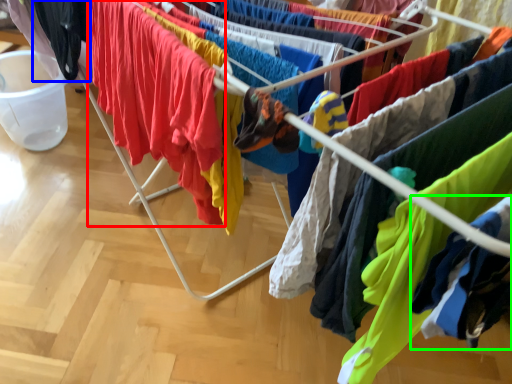
Question: Which object is the farthest from clothing (highlighted by a red box)? Choose among these: clothing (highlighted by a blue box) or clothing (highlighted by a green box).

Choices:
 (A) clothing
 (B) clothing

Answer: (B)